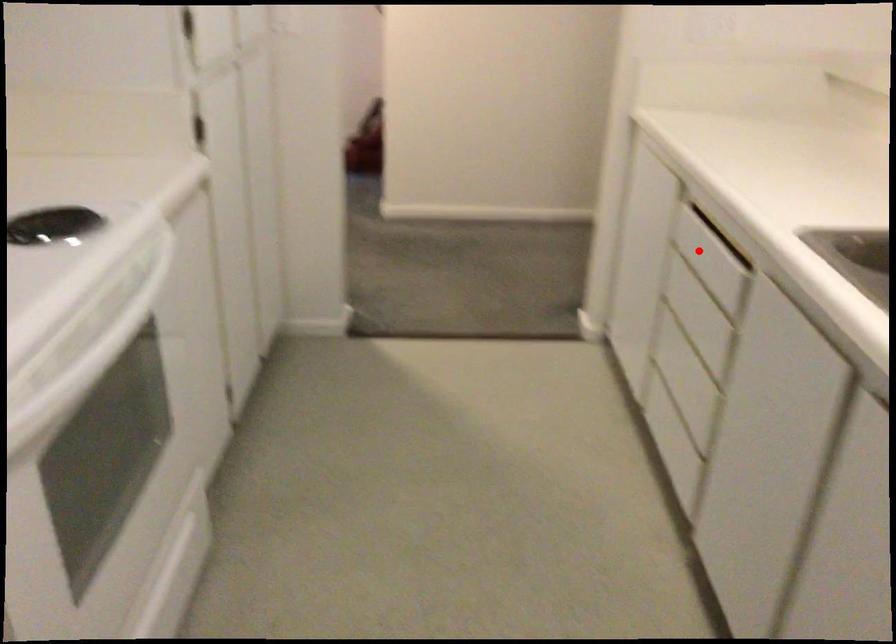
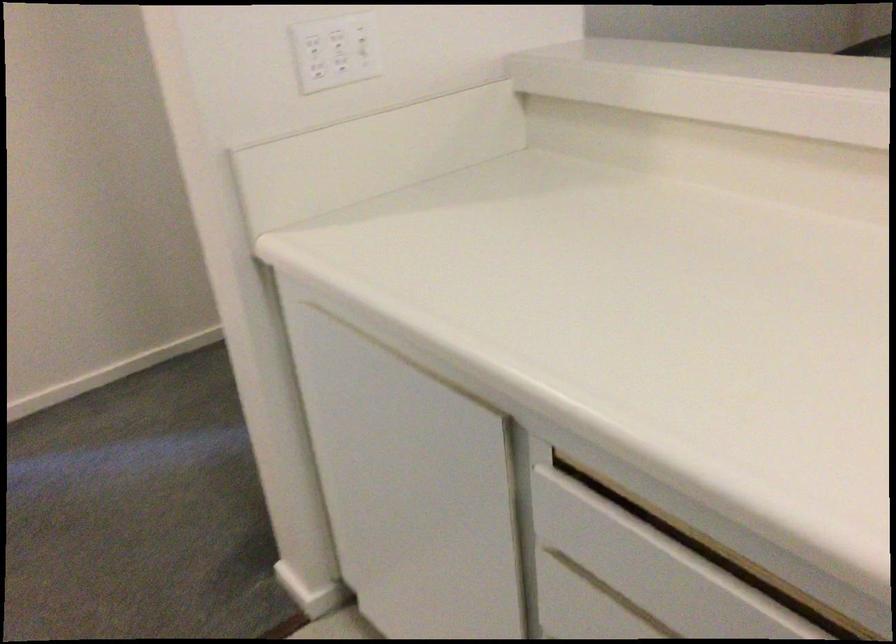
The point at the highlighted location is marked in the first image. Where is the corresponding point in the second image?

(640, 574)